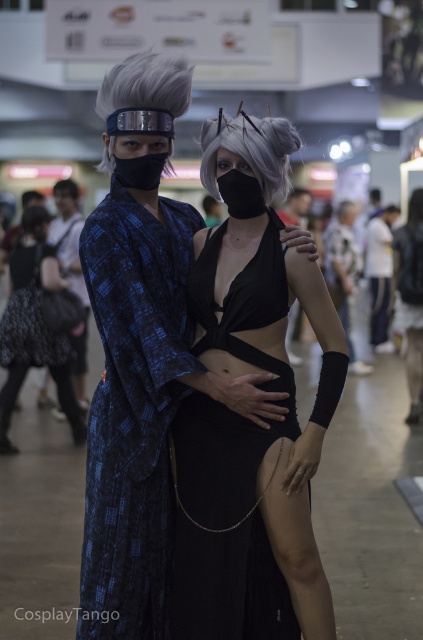
You are a photographer at a cosplay event. You need to position the blue patterned kimono at center and the matte black kimono at center so that both are fully visible in the photo. Given their heights, which kimono should be placed closer to the front to ensure both are visible?

The blue patterned kimono at center is shorter than the matte black kimono at center, so placing the blue patterned kimono at center in front will allow both to be fully visible in the photo.

Consider the image. You are a photographer at a cosplay event. You need to position the two cosplayers so that their kimonos don not overlap in the photo. Given that the matte blue kimono at left is larger than the matte black kimono at center, which kimono should be placed closer to the camera to ensure both are fully visible without overlapping?

The matte blue kimono at left should be placed closer to the camera since it is larger. By positioning the larger kimono in front, it can block less of the smaller matte black kimono at center, allowing both to be fully visible without overlapping.